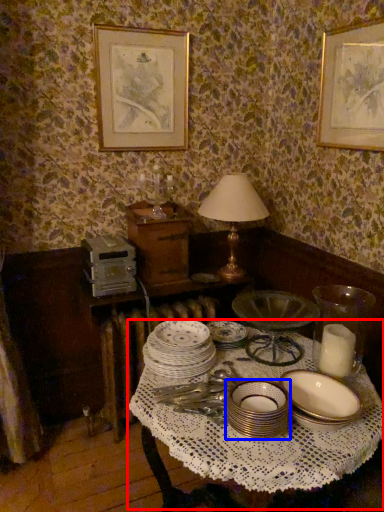
Question: Among these objects, which one is nearest to the camera, round table (highlighted by a red box) or tableware (highlighted by a blue box)?

Choices:
 (A) round table
 (B) tableware

Answer: (A)